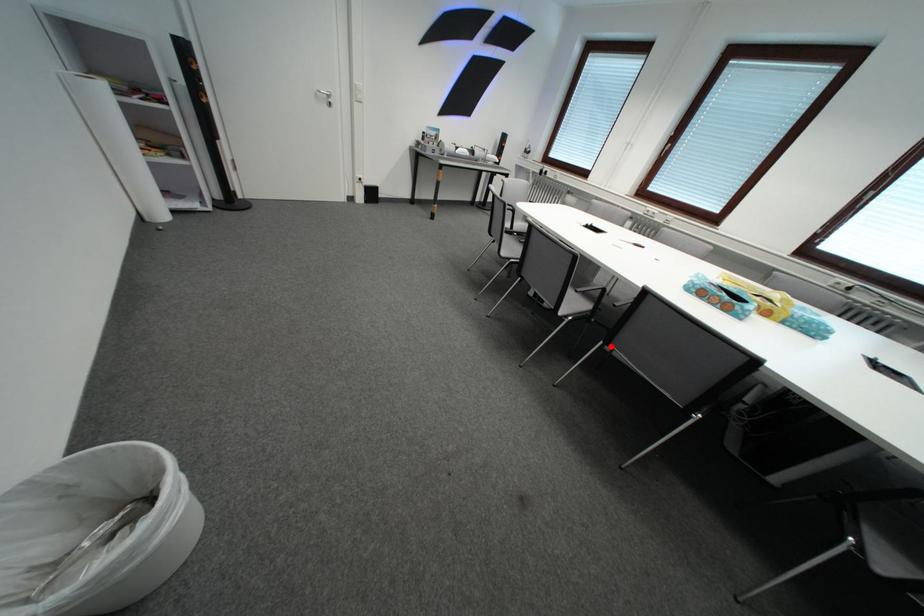
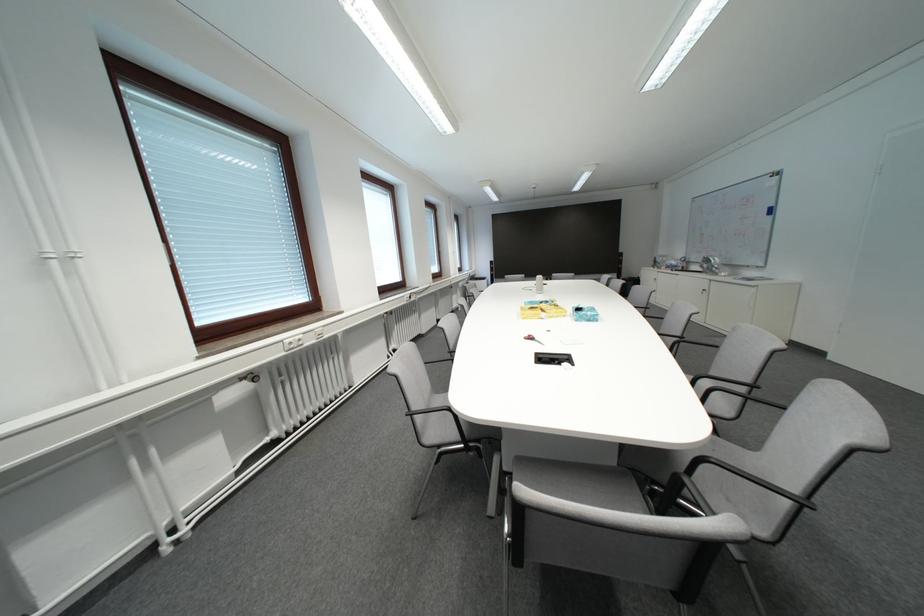
Question: I am providing you with two images of the same scene from different viewpoints. A red point is marked on the first image. Can you still see the location of the red point in image 2?

Choices:
 (A) Yes
 (B) No

Answer: (B)